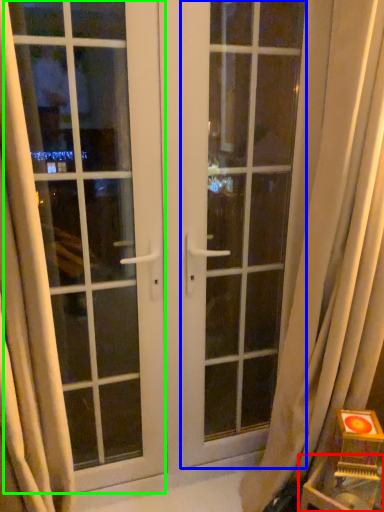
Question: Which is farther away from furniture (highlighted by a red box)? screen door (highlighted by a blue box) or window (highlighted by a green box)?

Choices:
 (A) screen door
 (B) window

Answer: (B)